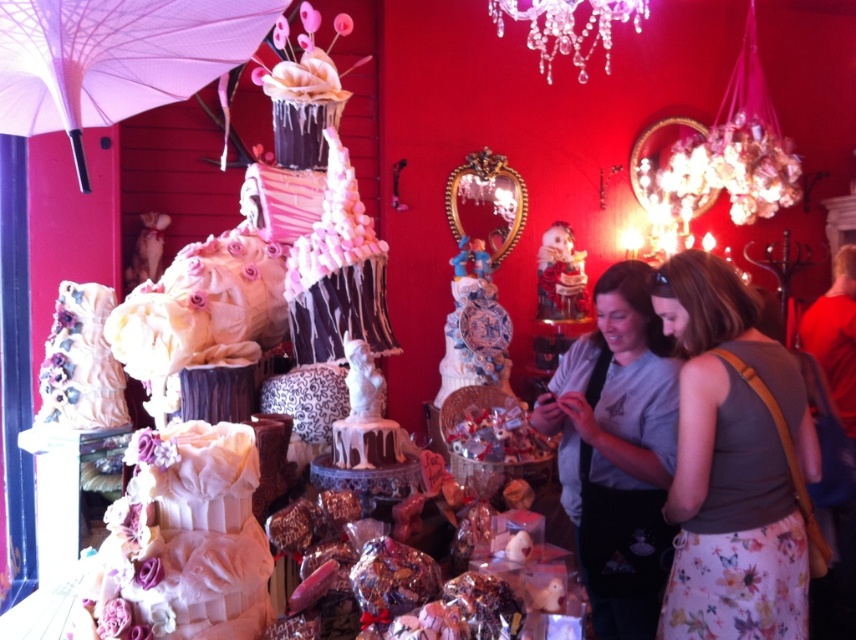
What do you see at coordinates (728, 156) in the screenshot?
I see `shiny metallic chandelier at upper right` at bounding box center [728, 156].

Find the location of a particular element. shiny metallic chandelier at upper right is located at coordinates (728, 156).

Is matte gray tank top at center smaller than white fabric cake at center?

No.

Is matte gray tank top at center positioned behind white fabric cake at center?

Yes, matte gray tank top at center is further from the viewer.

Which is behind, point (703, 486) or point (141, 449)?

The point (703, 486) is behind.

Find the location of a particular element. The width and height of the screenshot is (856, 640). matte gray tank top at center is located at coordinates (732, 465).

Is pink fabric umbrella at upper left further to camera compared to shiny metallic chandelier at upper right?

No, it is not.

Between pink fabric umbrella at upper left and shiny metallic chandelier at upper right, which one has more height?

With more height is shiny metallic chandelier at upper right.

Is point (188, 72) closer to camera compared to point (639, 176)?

Yes, point (188, 72) is in front of point (639, 176).

Where is `pink fabric umbrella at upper left`? pink fabric umbrella at upper left is located at coordinates (116, 58).